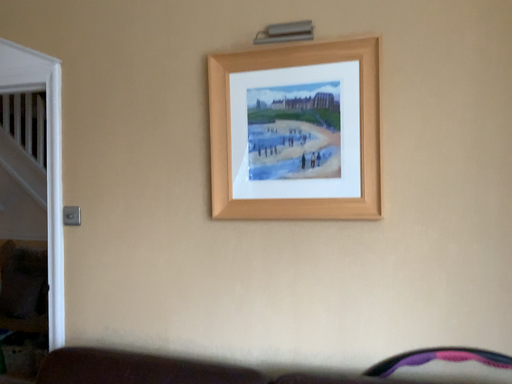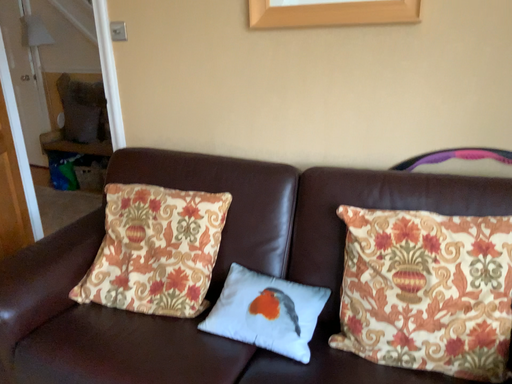
Question: Which way did the camera rotate in the video?

Choices:
 (A) rotated downward
 (B) rotated upward

Answer: (A)